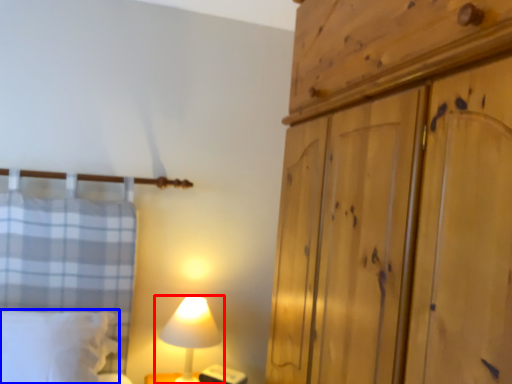
Question: Which object appears farthest to the camera in this image, lamp (highlighted by a red box) or pillow (highlighted by a blue box)?

Choices:
 (A) lamp
 (B) pillow

Answer: (A)